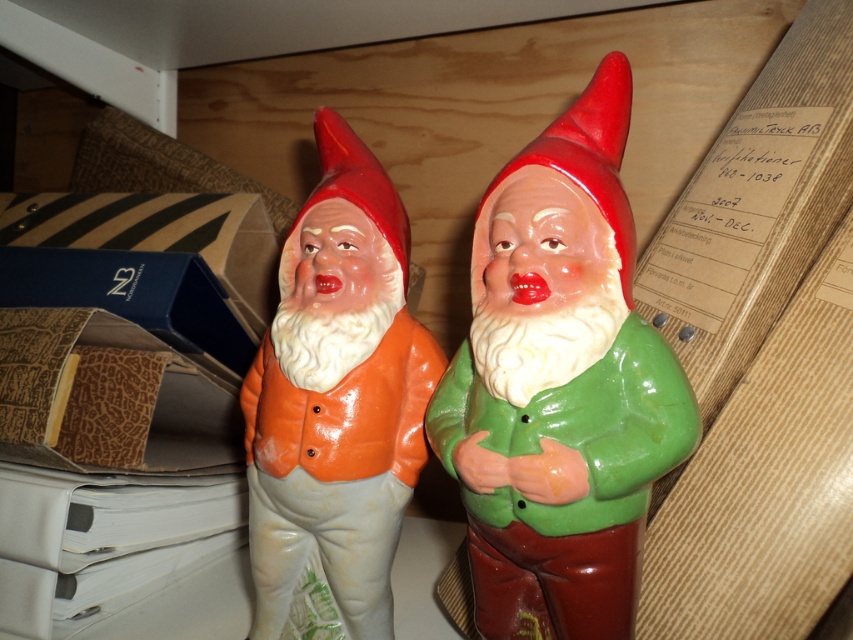
Question: Does green glossy gnome at center have a smaller size compared to orange glossy vest at center?

Choices:
 (A) no
 (B) yes

Answer: (A)

Question: Can you confirm if green glossy gnome at center is wider than orange glossy vest at center?

Choices:
 (A) yes
 (B) no

Answer: (A)

Question: Can you confirm if green glossy gnome at center is thinner than orange glossy vest at center?

Choices:
 (A) no
 (B) yes

Answer: (A)